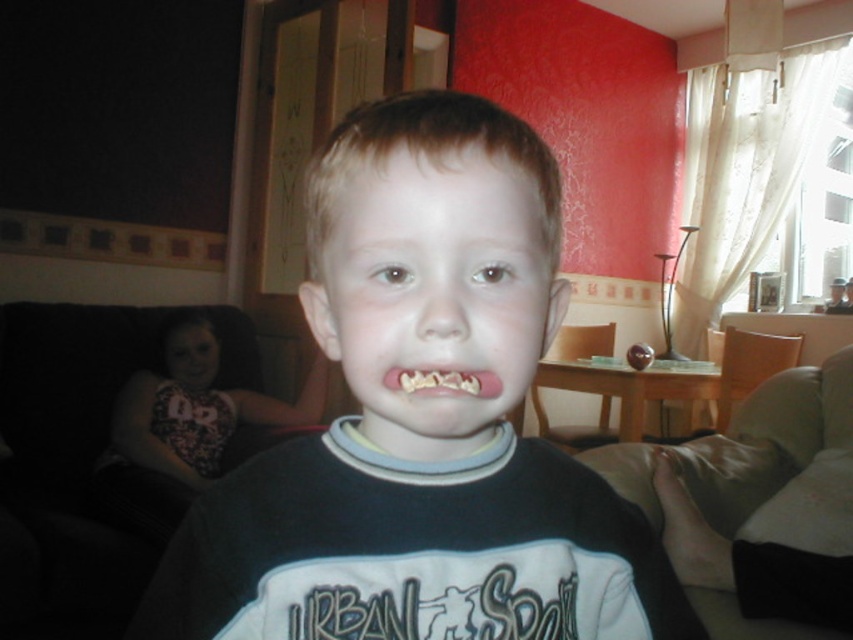
How much distance is there between dark pink fabric at left and pink rubber mouth at center?

They are 1.88 meters apart.

Is point (223, 426) more distant than point (404, 371)?

Yes, it is.

Locate an element on the screen. This screenshot has height=640, width=853. dark pink fabric at left is located at coordinates (196, 406).

Between black cotton shirt at center and dark pink fabric at left, which one is positioned lower?

Positioned lower is dark pink fabric at left.

Does black cotton shirt at center have a larger size compared to dark pink fabric at left?

No, black cotton shirt at center is not bigger than dark pink fabric at left.

Find the location of a particular element. This screenshot has height=640, width=853. black cotton shirt at center is located at coordinates (421, 420).

The image size is (853, 640). What are the coordinates of `black cotton shirt at center` in the screenshot? It's located at (x=421, y=420).

Which is above, black cotton shirt at center or pink rubber mouth at center?

pink rubber mouth at center is above.

Describe the element at coordinates (421, 420) in the screenshot. I see `black cotton shirt at center` at that location.

The image size is (853, 640). Find the location of `black cotton shirt at center`. black cotton shirt at center is located at coordinates (421, 420).

Locate an element on the screen. Image resolution: width=853 pixels, height=640 pixels. black cotton shirt at center is located at coordinates (421, 420).